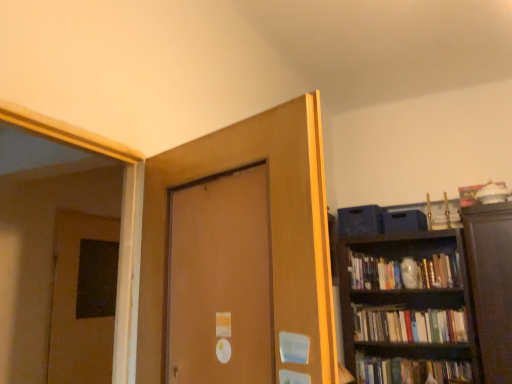
Question: Is point (315, 301) positioned closer to the camera than point (73, 221)?

Choices:
 (A) closer
 (B) farther

Answer: (A)

Question: Is matte brown door at center, placed as the 2th door when sorted from left to right, situated inside brown matte door at left, positioned as the second door in right-to-left order, or outside?

Choices:
 (A) inside
 (B) outside

Answer: (B)

Question: Which object is the farthest from the hardcover books at right?

Choices:
 (A) brown matte door at left, placed as the 1th door when sorted from left to right
 (B) matte brown door at center, which appears as the 1th door when viewed from the right

Answer: (B)

Question: Estimate the real-world distances between objects in this image. Which object is farther from the hardcover books at right?

Choices:
 (A) brown matte door at left, positioned as the second door in right-to-left order
 (B) matte brown door at center, which appears as the 1th door when viewed from the right

Answer: (B)